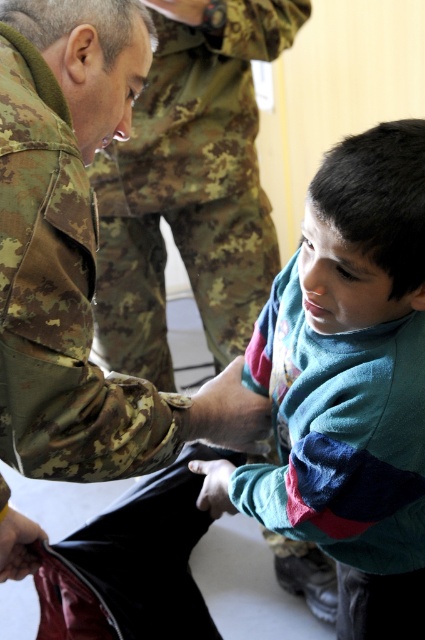
Looking at this image, you are organizing a clothing donation drive and need to pack items efficiently. You have a teal soft sweater at center and a camouflage fabric uniform at upper left. Which item should you choose to maximize space in the box if you can only take one?

The teal soft sweater at center occupies less space than the camouflage fabric uniform at upper left, so choosing the teal soft sweater at center would allow more space in the box.

You are an interior designer planning to place a new lamp in the room. The teal soft sweater at center is currently at position coordinates 0.602, 0.821. Where would you place the lamp so it doesn not block the sweater?

Place the lamp away from the coordinates (348, 385) where the teal soft sweater at center is located to avoid blocking it.

Looking at this image, you are a tailor observing the scene. You need to determine if the teal soft sweater at center can be worn over the camouflage fabric uniform at upper left. Based on their lengths, what do you advise?

The teal soft sweater at center is shorter than the camouflage fabric uniform at upper left. Therefore, the sweater would not cover the entire uniform when worn over it, leaving parts of the uniform visible. It is advisable to choose a longer garment if full coverage is needed.